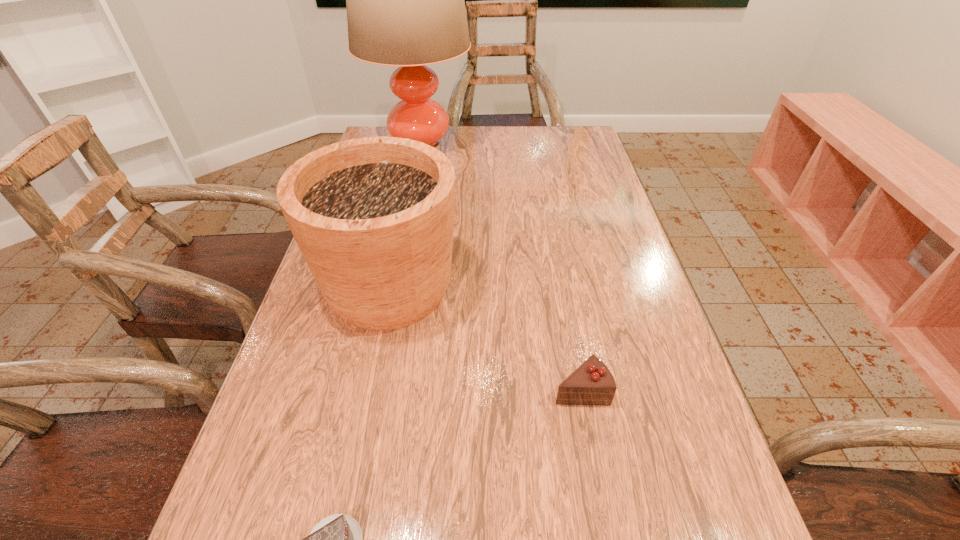
At what (x,y) coordinates should I click in order to perform the action: click on empty space that is in between the second tallest object and the rightmost object. Please return your answer as a coordinate pair (x, y). Image resolution: width=960 pixels, height=540 pixels. Looking at the image, I should click on (485, 338).

Locate an element on the screen. This screenshot has height=540, width=960. object identified as the closest to the second tallest object is located at coordinates (592, 383).

Where is `object that is the second nearest to the nearest object`? object that is the second nearest to the nearest object is located at coordinates (592, 383).

Where is `free space that satisfies the following two spatial constraints: 1. on the front side of the right chocolate cake; 2. on the left side of the tallest object`? The width and height of the screenshot is (960, 540). free space that satisfies the following two spatial constraints: 1. on the front side of the right chocolate cake; 2. on the left side of the tallest object is located at coordinates (373, 388).